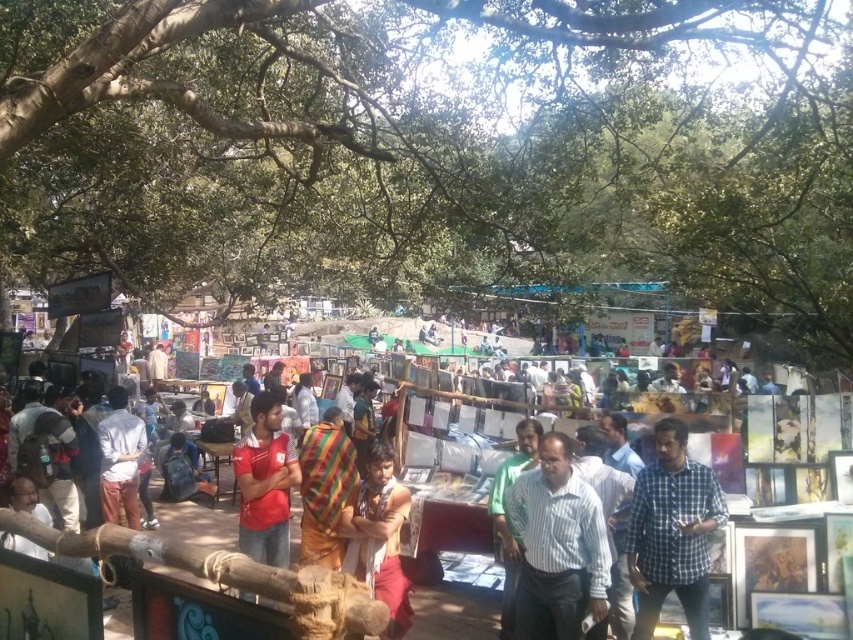
Measure the distance between green leafy tree at upper center and camera.

green leafy tree at upper center is 5.37 meters from camera.

Is green leafy tree at upper center thinner than red cotton shirt at center?

No, green leafy tree at upper center is not thinner than red cotton shirt at center.

What are the coordinates of `green leafy tree at upper center` in the screenshot? It's located at (437, 154).

This screenshot has width=853, height=640. What are the coordinates of `green leafy tree at upper center` in the screenshot? It's located at (437, 154).

Can you confirm if striped cotton shirt at center is positioned to the right of multicolored woven cloth at center?

Correct, you'll find striped cotton shirt at center to the right of multicolored woven cloth at center.

In the scene shown: Is striped cotton shirt at center above multicolored woven cloth at center?

Correct, striped cotton shirt at center is located above multicolored woven cloth at center.

I want to click on striped cotton shirt at center, so click(556, 547).

Does point (625, 163) come closer to viewer compared to point (401, 600)?

That is False.

Identify the location of green leafy tree at upper center. This screenshot has height=640, width=853. (437, 154).